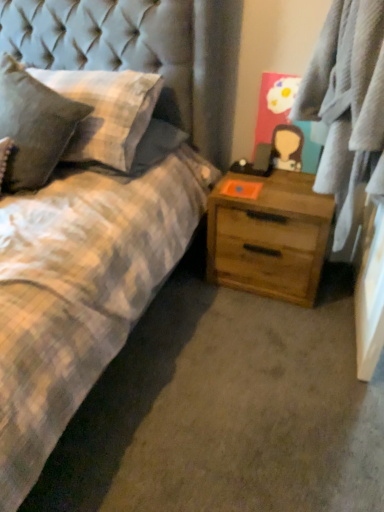
Question: Can you confirm if light brown wood chest of drawers at center-right is smaller than plaid fabric pillow at left, which is the second pillow from right to left?

Choices:
 (A) no
 (B) yes

Answer: (B)

Question: Is plaid fabric pillow at left, which is the second pillow from right to left, at the back of light brown wood chest of drawers at center-right?

Choices:
 (A) yes
 (B) no

Answer: (B)

Question: Is light brown wood chest of drawers at center-right to the left of plaid fabric pillow at left, marked as the first pillow in a left-to-right arrangement, from the viewer's perspective?

Choices:
 (A) no
 (B) yes

Answer: (A)

Question: Can plaid fabric pillow at left, marked as the first pillow in a left-to-right arrangement, be found inside light brown wood chest of drawers at center-right?

Choices:
 (A) no
 (B) yes

Answer: (A)

Question: From a real-world perspective, is light brown wood chest of drawers at center-right positioned under plaid fabric pillow at left, which is the second pillow from right to left, based on gravity?

Choices:
 (A) yes
 (B) no

Answer: (A)

Question: From the image's perspective, relative to plaid fabric at right, is textured gray pillow at left, which appears as the first pillow when viewed from the right, above or below?

Choices:
 (A) below
 (B) above

Answer: (B)

Question: Considering their positions, is textured gray pillow at left, which appears as the first pillow when viewed from the right, located in front of or behind plaid fabric at right?

Choices:
 (A) front
 (B) behind

Answer: (B)

Question: Considering the positions of textured gray pillow at left, which appears as the first pillow when viewed from the right, and plaid fabric at right in the image, is textured gray pillow at left, which appears as the first pillow when viewed from the right, taller or shorter than plaid fabric at right?

Choices:
 (A) short
 (B) tall

Answer: (A)

Question: Based on their sizes in the image, would you say textured gray pillow at left, which appears as the first pillow when viewed from the right, is bigger or smaller than plaid fabric at right?

Choices:
 (A) big
 (B) small

Answer: (B)

Question: In the image, is plaid fabric pillow at left, marked as the first pillow in a left-to-right arrangement, on the left side or the right side of textured gray pillow at left, marked as the 2th pillow in a left-to-right arrangement?

Choices:
 (A) left
 (B) right

Answer: (A)

Question: Is plaid fabric pillow at left, marked as the first pillow in a left-to-right arrangement, taller or shorter than textured gray pillow at left, which appears as the first pillow when viewed from the right?

Choices:
 (A) tall
 (B) short

Answer: (A)

Question: From the image's perspective, is plaid fabric pillow at left, which is the second pillow from right to left, located above or below textured gray pillow at left, marked as the 2th pillow in a left-to-right arrangement?

Choices:
 (A) above
 (B) below

Answer: (B)

Question: Does point (56, 159) appear closer or farther from the camera than point (140, 130)?

Choices:
 (A) farther
 (B) closer

Answer: (B)

Question: Based on their sizes in the image, would you say light brown wood chest of drawers at center-right is bigger or smaller than textured gray pillow at left, which appears as the first pillow when viewed from the right?

Choices:
 (A) small
 (B) big

Answer: (B)

Question: From their relative heights in the image, would you say light brown wood chest of drawers at center-right is taller or shorter than textured gray pillow at left, which appears as the first pillow when viewed from the right?

Choices:
 (A) tall
 (B) short

Answer: (A)